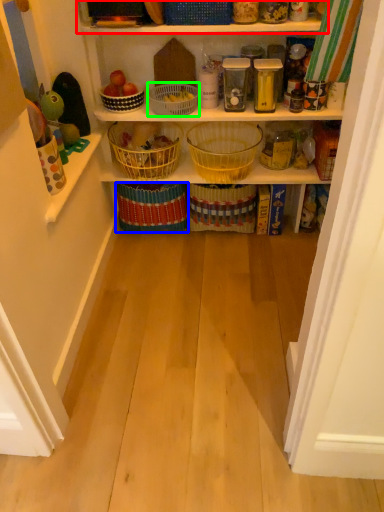
Question: Which is nearer to the shelf (highlighted by a red box)? basket (highlighted by a blue box) or basket (highlighted by a green box).

Choices:
 (A) basket
 (B) basket

Answer: (B)